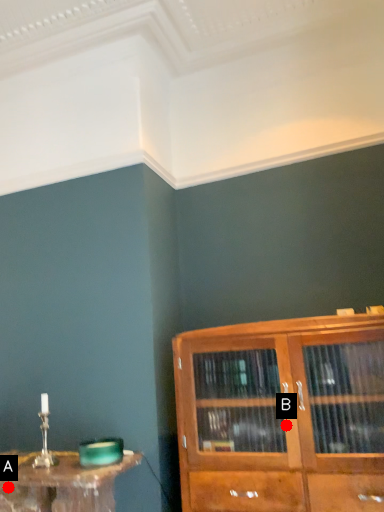
Question: Two points are circled on the image, labeled by A and B beside each circle. Among these points, which one is nearest to the camera?

Choices:
 (A) A is closer
 (B) B is closer

Answer: (B)